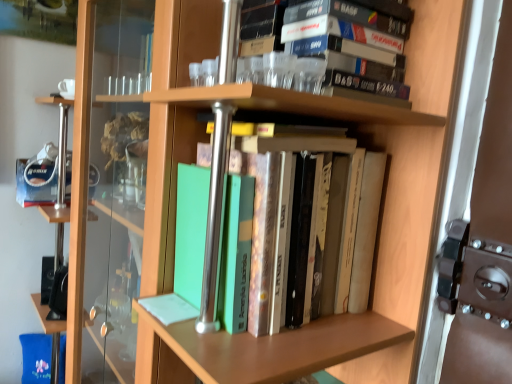
Question: Is matte black cassette tape at upper center, arranged as the second book when ordered from the bottom, facing towards green matte book at center, positioned as the 2th book in top-to-bottom order?

Choices:
 (A) no
 (B) yes

Answer: (A)

Question: From a real-world perspective, is matte black cassette tape at upper center, the 1th book positioned from the top, positioned over green matte book at center, positioned as the 2th book in top-to-bottom order, based on gravity?

Choices:
 (A) yes
 (B) no

Answer: (A)

Question: Is the depth of matte black cassette tape at upper center, arranged as the second book when ordered from the bottom, greater than that of green matte book at center, positioned as the 2th book in top-to-bottom order?

Choices:
 (A) yes
 (B) no

Answer: (A)

Question: Is matte black cassette tape at upper center, arranged as the second book when ordered from the bottom, to the right of green matte book at center, positioned as the 2th book in top-to-bottom order, from the viewer's perspective?

Choices:
 (A) yes
 (B) no

Answer: (A)

Question: Can green matte book at center, positioned as the 2th book in top-to-bottom order, be found inside matte black cassette tape at upper center, arranged as the second book when ordered from the bottom?

Choices:
 (A) yes
 (B) no

Answer: (B)

Question: Is matte black cassette tape at upper center, the 1th book positioned from the top, located outside green matte book at center, positioned as the 2th book in top-to-bottom order?

Choices:
 (A) yes
 (B) no

Answer: (A)

Question: Is the position of green matte book at center, positioned as the 2th book in top-to-bottom order, more distant than that of matte black cassette tape at upper center, arranged as the second book when ordered from the bottom?

Choices:
 (A) no
 (B) yes

Answer: (A)

Question: Can you confirm if green matte book at center, positioned as the 2th book in top-to-bottom order, is bigger than matte black cassette tape at upper center, the 1th book positioned from the top?

Choices:
 (A) no
 (B) yes

Answer: (B)

Question: Can you confirm if green matte book at center, which is the first book in bottom-to-top order, is wider than matte black cassette tape at upper center, arranged as the second book when ordered from the bottom?

Choices:
 (A) no
 (B) yes

Answer: (B)

Question: Is green matte book at center, positioned as the 2th book in top-to-bottom order, thinner than matte black cassette tape at upper center, the 1th book positioned from the top?

Choices:
 (A) yes
 (B) no

Answer: (B)

Question: From the image's perspective, is green matte book at center, positioned as the 2th book in top-to-bottom order, under matte black cassette tape at upper center, the 1th book positioned from the top?

Choices:
 (A) yes
 (B) no

Answer: (A)

Question: Is green matte book at center, which is the first book in bottom-to-top order, smaller than matte black cassette tape at upper center, the 1th book positioned from the top?

Choices:
 (A) no
 (B) yes

Answer: (A)

Question: From a real-world perspective, is green matte book at center, which is the first book in bottom-to-top order, positioned above or below matte black cassette tape at upper center, arranged as the second book when ordered from the bottom?

Choices:
 (A) above
 (B) below

Answer: (B)